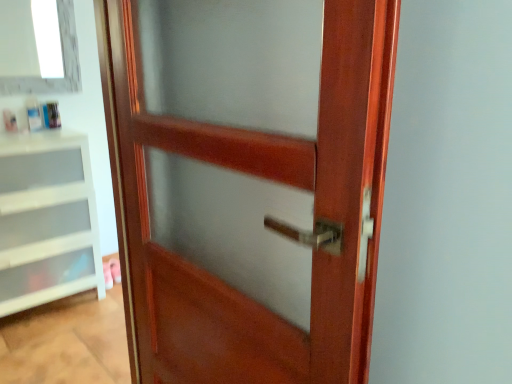
Question: Is white plastic drawer at left taller than mahogany wood door at center?

Choices:
 (A) yes
 (B) no

Answer: (B)

Question: Considering the relative sizes of white plastic drawer at left and mahogany wood door at center in the image provided, is white plastic drawer at left shorter than mahogany wood door at center?

Choices:
 (A) no
 (B) yes

Answer: (B)

Question: Is white plastic drawer at left smaller than mahogany wood door at center?

Choices:
 (A) no
 (B) yes

Answer: (A)

Question: From a real-world perspective, is white plastic drawer at left beneath mahogany wood door at center?

Choices:
 (A) no
 (B) yes

Answer: (B)

Question: Considering the relative sizes of white plastic drawer at left and mahogany wood door at center in the image provided, is white plastic drawer at left thinner than mahogany wood door at center?

Choices:
 (A) no
 (B) yes

Answer: (A)

Question: Is the depth of white plastic drawer at left greater than that of mahogany wood door at center?

Choices:
 (A) no
 (B) yes

Answer: (B)

Question: Does white glass window at upper left turn towards white plastic drawer at left?

Choices:
 (A) no
 (B) yes

Answer: (A)

Question: From the image's perspective, is white glass window at upper left beneath white plastic drawer at left?

Choices:
 (A) yes
 (B) no

Answer: (B)

Question: Is white glass window at upper left positioned before white plastic drawer at left?

Choices:
 (A) yes
 (B) no

Answer: (B)

Question: Is white glass window at upper left in contact with white plastic drawer at left?

Choices:
 (A) no
 (B) yes

Answer: (A)

Question: Is white glass window at upper left to the left of white plastic drawer at left from the viewer's perspective?

Choices:
 (A) no
 (B) yes

Answer: (A)

Question: Does white glass window at upper left come behind white plastic drawer at left?

Choices:
 (A) yes
 (B) no

Answer: (A)

Question: From a real-world perspective, is mahogany wood door at center positioned over white plastic drawer at left based on gravity?

Choices:
 (A) no
 (B) yes

Answer: (B)